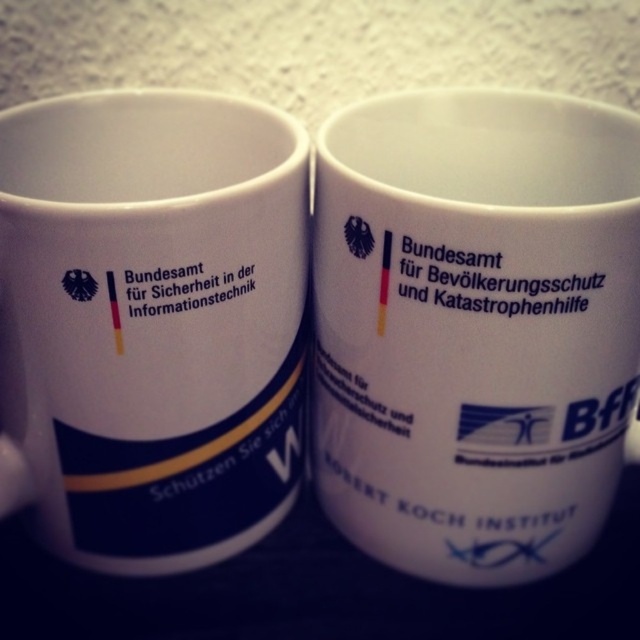
Question: Which point appears farthest from the camera in this image?

Choices:
 (A) (273, 172)
 (B) (528, 305)

Answer: (A)

Question: Can you confirm if white ceramic mug at center is bigger than white ceramic mug at left?

Choices:
 (A) yes
 (B) no

Answer: (A)

Question: Which point is closer to the camera?

Choices:
 (A) (136, 106)
 (B) (429, 358)

Answer: (B)

Question: Can you confirm if white ceramic mug at center is positioned to the left of white ceramic mug at left?

Choices:
 (A) no
 (B) yes

Answer: (A)

Question: Is white ceramic mug at center closer to camera compared to white ceramic mug at left?

Choices:
 (A) no
 (B) yes

Answer: (A)